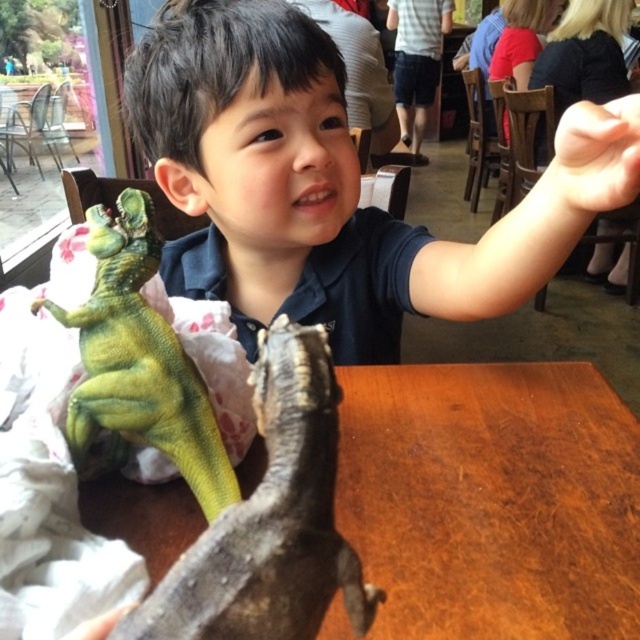
Question: Is the position of leather-like brown lizard at center more distant than that of green matte dinosaur at left?

Choices:
 (A) no
 (B) yes

Answer: (A)

Question: Can you confirm if leather-like brown lizard at center is bigger than green matte dinosaur at left?

Choices:
 (A) no
 (B) yes

Answer: (A)

Question: Which point is farther to the camera?

Choices:
 (A) 134,358
 (B) 272,540

Answer: (A)

Question: Does leather-like brown lizard at center appear under green matte dinosaur at left?

Choices:
 (A) no
 (B) yes

Answer: (B)

Question: Which point appears farthest from the camera in this image?

Choices:
 (A) (273, 348)
 (B) (147, 362)

Answer: (B)

Question: Which of the following is the closest to the observer?

Choices:
 (A) leather-like brown lizard at center
 (B) green matte dinosaur at left

Answer: (A)